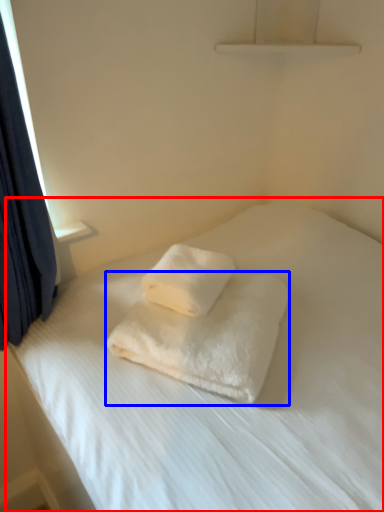
Question: Which object is closer to the camera taking this photo, bed (highlighted by a red box) or towel (highlighted by a blue box)?

Choices:
 (A) bed
 (B) towel

Answer: (A)